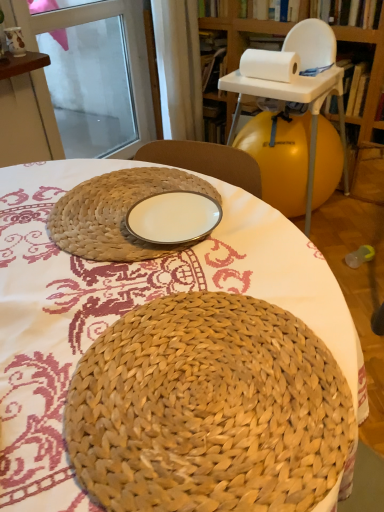
Question: In terms of size, does white fabric curtain at upper center appear bigger or smaller than white glossy plate at center?

Choices:
 (A) big
 (B) small

Answer: (A)

Question: In the image, is white fabric curtain at upper center on the left side or the right side of white glossy plate at center?

Choices:
 (A) left
 (B) right

Answer: (A)

Question: Based on their relative distances, which object is farther from the woven straw basket at center?

Choices:
 (A) white fabric curtain at upper center
 (B) transparent glass screen door at upper left
 (C) white glossy plate at center
 (D) wooden bookshelf at upper right
 (E) natural woven placemat at center

Answer: (A)

Question: Based on their relative distances, which object is farther from the white fabric curtain at upper center?

Choices:
 (A) natural woven placemat at center
 (B) white glossy plate at center
 (C) wooden bookshelf at upper right
 (D) white paper at upper right
 (E) transparent glass screen door at upper left

Answer: (B)